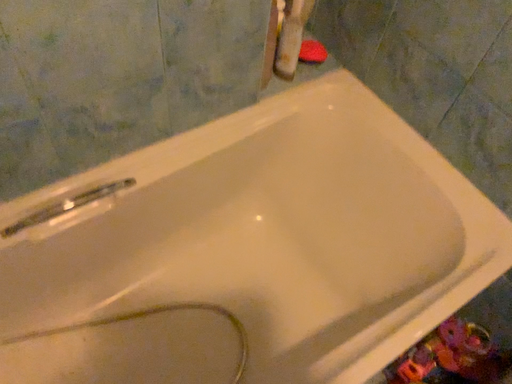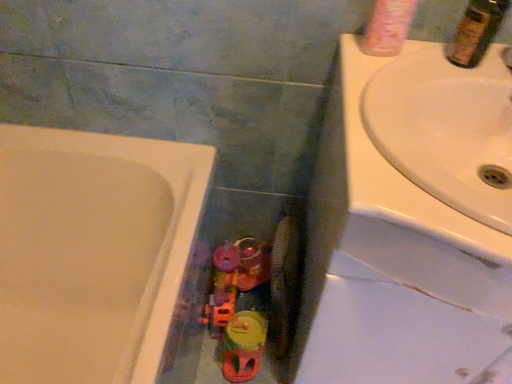
Question: How did the camera likely rotate when shooting the video?

Choices:
 (A) rotated right
 (B) rotated left

Answer: (A)